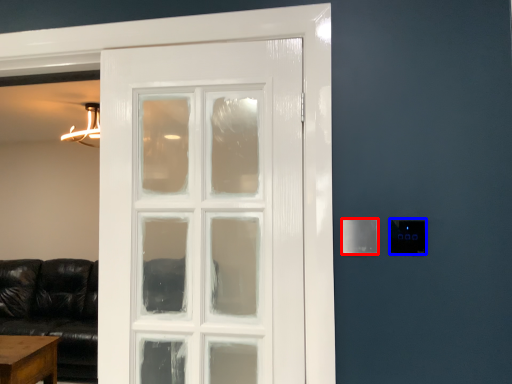
Question: Which object appears farthest to the camera in this image, light switch (highlighted by a red box) or light switch (highlighted by a blue box)?

Choices:
 (A) light switch
 (B) light switch

Answer: (A)